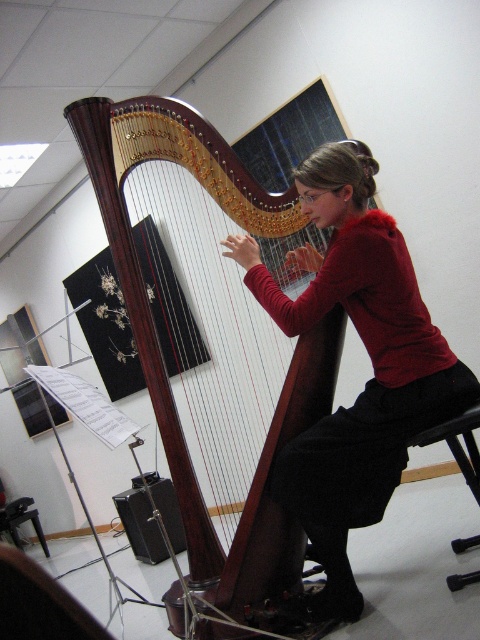
Question: Which point appears closest to the camera in this image?

Choices:
 (A) (467, 540)
 (B) (277, 419)
 (C) (41, 588)
 (D) (360, 266)

Answer: (C)

Question: Does wooden harp at center appear on the left side of black leather chair at lower center?

Choices:
 (A) yes
 (B) no

Answer: (A)

Question: In this image, where is wooden harp at center located relative to matte red sweater at center?

Choices:
 (A) below
 (B) above

Answer: (B)

Question: Which of the following is the farthest from the observer?

Choices:
 (A) wooden harp at center
 (B) black leather chair at lower center
 (C) black plastic stool at lower right

Answer: (A)

Question: Can you confirm if wooden harp at center is positioned to the right of matte red sweater at center?

Choices:
 (A) no
 (B) yes

Answer: (A)

Question: Which object is the farthest from the wooden harp at center?

Choices:
 (A) black leather chair at lower center
 (B) black plastic stool at lower right
 (C) matte red sweater at center

Answer: (A)